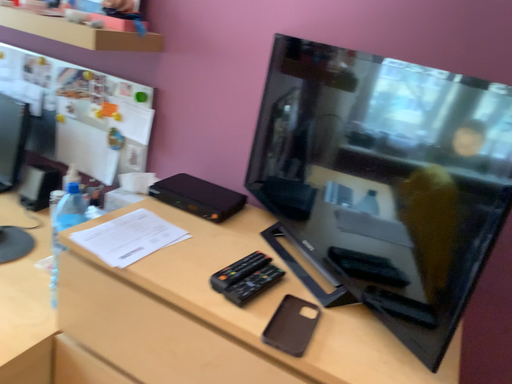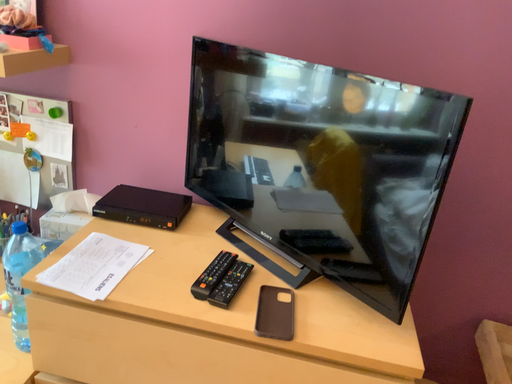
Question: Which way did the camera rotate in the video?

Choices:
 (A) rotated left
 (B) rotated right

Answer: (B)